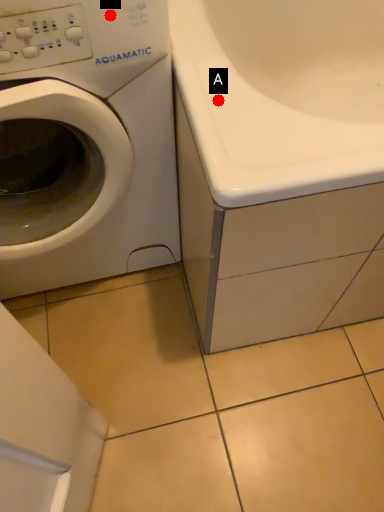
Question: Two points are circled on the image, labeled by A and B beside each circle. Which point appears closest to the camera in this image?

Choices:
 (A) A is closer
 (B) B is closer

Answer: (B)